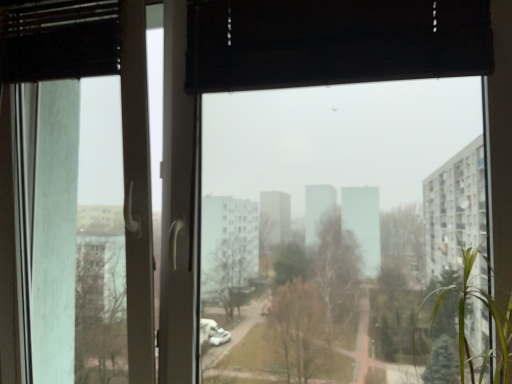
Question: Visually, is transparent glass window at center positioned to the left or to the right of transparent glass screen door at left?

Choices:
 (A) left
 (B) right

Answer: (B)

Question: Is transparent glass window at center spatially inside transparent glass screen door at left, or outside of it?

Choices:
 (A) outside
 (B) inside

Answer: (A)

Question: Estimate the real-world distances between objects in this image. Which object is closer to the transparent glass screen door at left?

Choices:
 (A) green leafy plant at right
 (B) transparent glass window at center

Answer: (A)

Question: Which of these objects is positioned closest to the transparent glass window at center?

Choices:
 (A) transparent glass screen door at left
 (B) green leafy plant at right

Answer: (B)